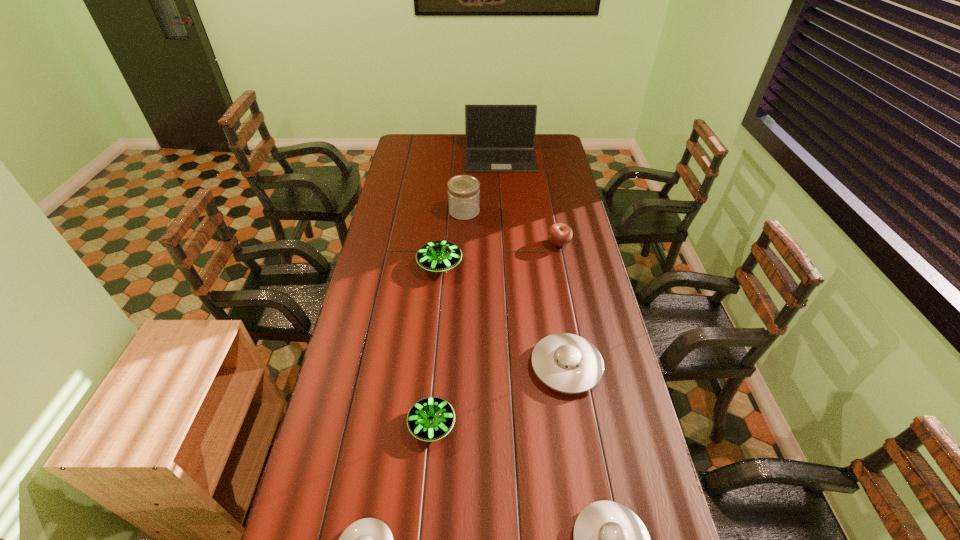
Identify the location of free space between the tallest object and the jar. (483, 185).

Identify the location of vacant point located between the smaller green saucer and the farthest gray saucer. The width and height of the screenshot is (960, 540). (499, 395).

Identify which object is the sixth closest to the fifth farthest object. Please provide its 2D coordinates. Your answer should be formatted as a tuple, i.e. [(x, y)], where the tuple contains the x and y coordinates of a point satisfying the conditions above.

[(463, 190)]

Find the location of `object that ranks as the sixth closest to the farthest object`. object that ranks as the sixth closest to the farthest object is located at coordinates (609, 539).

Select which saucer is the second closest to the second biggest gray saucer. Please provide its 2D coordinates. Your answer should be formatted as a tuple, i.e. [(x, y)], where the tuple contains the x and y coordinates of a point satisfying the conditions above.

[(430, 419)]

You are a GUI agent. You are given a task and a screenshot of the screen. Output one action in this format:
    pyautogui.click(x=<x>, y=<y>)
    Task: Click on the second closest saucer to the farther green saucer
    This screenshot has height=540, width=960.
    Given the screenshot: What is the action you would take?
    pyautogui.click(x=430, y=419)

Identify which gray saucer is the second closest to the third nearest saucer. Please provide its 2D coordinates. Your answer should be formatted as a tuple, i.e. [(x, y)], where the tuple contains the x and y coordinates of a point satisfying the conditions above.

[(567, 363)]

This screenshot has height=540, width=960. What are the coordinates of `gray saucer that is the third closest one to the apple` in the screenshot? It's located at (369, 539).